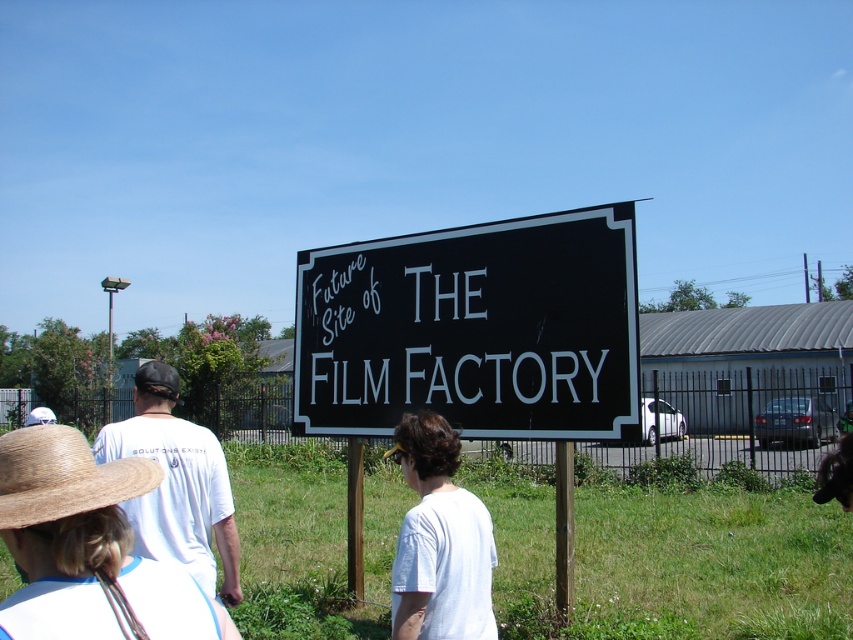
Is white cotton shirt at left shorter than brown straw hat at lower left?

In fact, white cotton shirt at left may be taller than brown straw hat at lower left.

What do you see at coordinates (86, 545) in the screenshot?
I see `white cotton shirt at left` at bounding box center [86, 545].

You are a GUI agent. You are given a task and a screenshot of the screen. Output one action in this format:
    pyautogui.click(x=<x>, y=<y>)
    Task: Click on the white cotton shirt at left
    The image size is (853, 640).
    Given the screenshot: What is the action you would take?
    pyautogui.click(x=86, y=545)

Where is `white cotton shirt at left`? white cotton shirt at left is located at coordinates (86, 545).

Is white cotton shirt at center taller than brown straw hat at lower left?

Yes, white cotton shirt at center is taller than brown straw hat at lower left.

Measure the distance between white cotton shirt at center and camera.

They are 2.84 meters apart.

The height and width of the screenshot is (640, 853). Identify the location of white cotton shirt at center. point(439,540).

Where is `white cotton shirt at center`? The width and height of the screenshot is (853, 640). white cotton shirt at center is located at coordinates (439, 540).

Who is more forward, (76, 513) or (202, 481)?

Point (76, 513) is more forward.

Does white cotton shirt at left have a greater width compared to white cotton t-shirt at center-left?

Incorrect, white cotton shirt at left's width does not surpass white cotton t-shirt at center-left's.

Identify the location of white cotton shirt at left. (86, 545).

Where is `white cotton shirt at left`? The height and width of the screenshot is (640, 853). white cotton shirt at left is located at coordinates (86, 545).